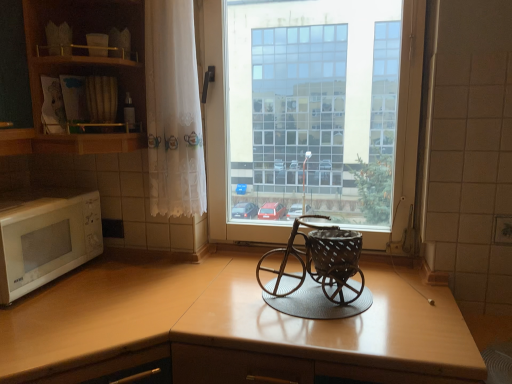
Question: Is white matte microwave at left to the left of wooden cabinet at upper left from the viewer's perspective?

Choices:
 (A) no
 (B) yes

Answer: (B)

Question: From the image's perspective, is white matte microwave at left below wooden cabinet at upper left?

Choices:
 (A) no
 (B) yes

Answer: (B)

Question: Can you confirm if white matte microwave at left is wider than wooden cabinet at upper left?

Choices:
 (A) no
 (B) yes

Answer: (A)

Question: From a real-world perspective, is white matte microwave at left below wooden cabinet at upper left?

Choices:
 (A) no
 (B) yes

Answer: (B)

Question: Can you confirm if white matte microwave at left is shorter than wooden cabinet at upper left?

Choices:
 (A) no
 (B) yes

Answer: (B)

Question: Does white matte microwave at left have a greater height compared to wooden cabinet at upper left?

Choices:
 (A) no
 (B) yes

Answer: (A)

Question: From a real-world perspective, is light brown laminate counter top at left positioned over transparent glass window at center based on gravity?

Choices:
 (A) no
 (B) yes

Answer: (A)

Question: Is light brown laminate counter top at left bigger than transparent glass window at center?

Choices:
 (A) no
 (B) yes

Answer: (B)

Question: From the image's perspective, does light brown laminate counter top at left appear higher than transparent glass window at center?

Choices:
 (A) yes
 (B) no

Answer: (B)

Question: Is light brown laminate counter top at left to the left of transparent glass window at center from the viewer's perspective?

Choices:
 (A) no
 (B) yes

Answer: (B)

Question: Can you confirm if light brown laminate counter top at left is thinner than transparent glass window at center?

Choices:
 (A) no
 (B) yes

Answer: (A)

Question: Is light brown laminate counter top at left not near transparent glass window at center?

Choices:
 (A) no
 (B) yes

Answer: (A)

Question: Is wooden cabinet at upper left to the right of wooden at center from the viewer's perspective?

Choices:
 (A) no
 (B) yes

Answer: (A)